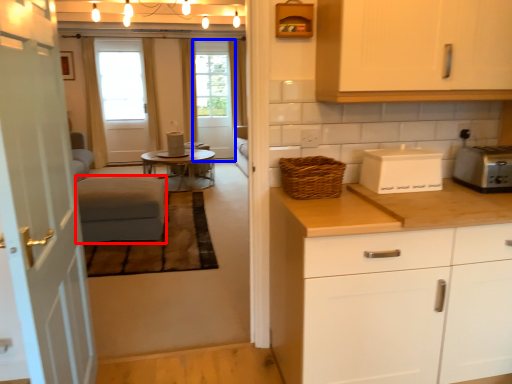
Question: Among these objects, which one is farthest to the camera, couch (highlighted by a red box) or screen door (highlighted by a blue box)?

Choices:
 (A) couch
 (B) screen door

Answer: (B)